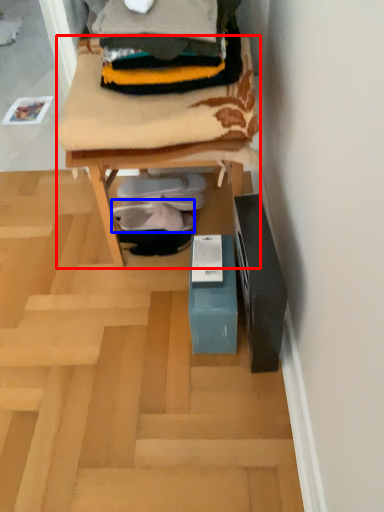
Question: Among these objects, which one is farthest to the camera, furniture (highlighted by a red box) or footwear (highlighted by a blue box)?

Choices:
 (A) furniture
 (B) footwear

Answer: (B)